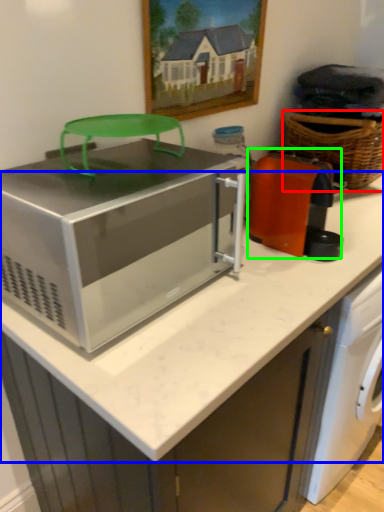
Question: Estimate the real-world distances between objects in this image. Which object is farther from basket (highlighted by a red box), counter top (highlighted by a blue box) or appliance (highlighted by a green box)?

Choices:
 (A) counter top
 (B) appliance

Answer: (A)